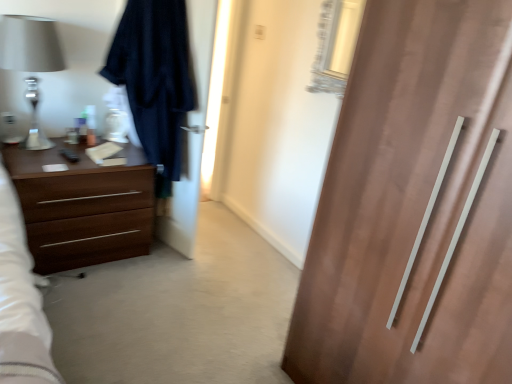
Question: Could you tell me if dark fabric screen door at left is turned towards dark blue fabric robe at left?

Choices:
 (A) yes
 (B) no

Answer: (A)

Question: Is dark fabric screen door at left oriented away from dark blue fabric robe at left?

Choices:
 (A) no
 (B) yes

Answer: (B)

Question: Is dark blue fabric robe at left inside dark fabric screen door at left?

Choices:
 (A) no
 (B) yes

Answer: (A)

Question: Is dark fabric screen door at left outside dark blue fabric robe at left?

Choices:
 (A) yes
 (B) no

Answer: (B)

Question: From a real-world perspective, is dark fabric screen door at left positioned under dark blue fabric robe at left based on gravity?

Choices:
 (A) yes
 (B) no

Answer: (B)

Question: Is point (57, 69) closer or farther from the camera than point (6, 153)?

Choices:
 (A) closer
 (B) farther

Answer: (B)

Question: Relative to brown wood chest of drawers at left, is matte silver lamp at left in front or behind?

Choices:
 (A) front
 (B) behind

Answer: (A)

Question: Visually, is matte silver lamp at left positioned to the left or to the right of brown wood chest of drawers at left?

Choices:
 (A) left
 (B) right

Answer: (A)

Question: From their relative heights in the image, would you say matte silver lamp at left is taller or shorter than brown wood chest of drawers at left?

Choices:
 (A) tall
 (B) short

Answer: (A)

Question: Is brown wood chest of drawers at left in front of or behind dark fabric screen door at left in the image?

Choices:
 (A) front
 (B) behind

Answer: (A)

Question: From the image's perspective, is brown wood chest of drawers at left located above or below dark fabric screen door at left?

Choices:
 (A) below
 (B) above

Answer: (A)

Question: From a real-world perspective, is brown wood chest of drawers at left physically located above or below dark fabric screen door at left?

Choices:
 (A) below
 (B) above

Answer: (A)

Question: In terms of size, does brown wood chest of drawers at left appear bigger or smaller than dark fabric screen door at left?

Choices:
 (A) small
 (B) big

Answer: (B)

Question: Considering the relative positions of brown wood chest of drawers at left and dark blue fabric robe at left in the image provided, is brown wood chest of drawers at left to the left or to the right of dark blue fabric robe at left?

Choices:
 (A) right
 (B) left

Answer: (B)

Question: Is brown wood chest of drawers at left wider or thinner than dark blue fabric robe at left?

Choices:
 (A) thin
 (B) wide

Answer: (B)